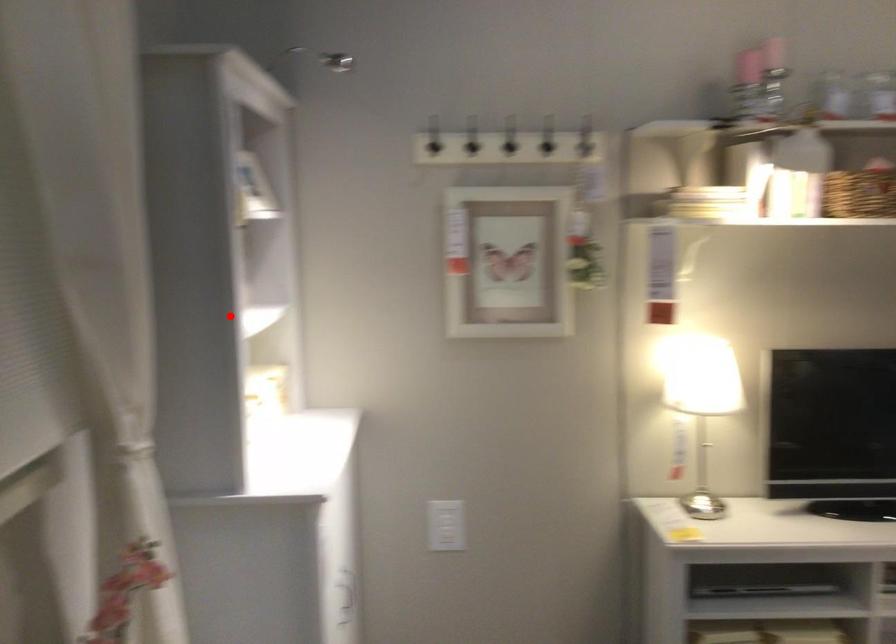
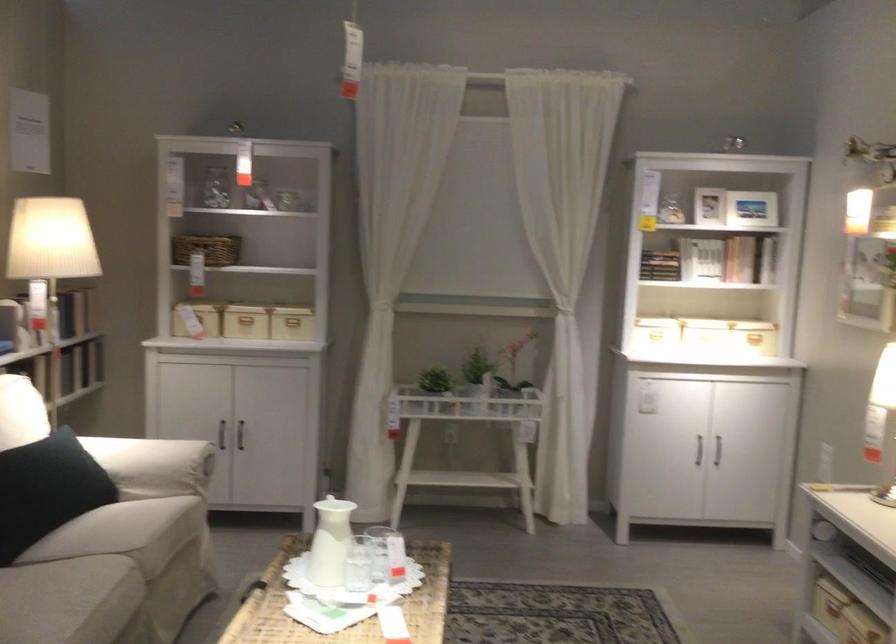
Locate, in the second image, the point that corresponds to the highlighted location in the first image.

(702, 259)